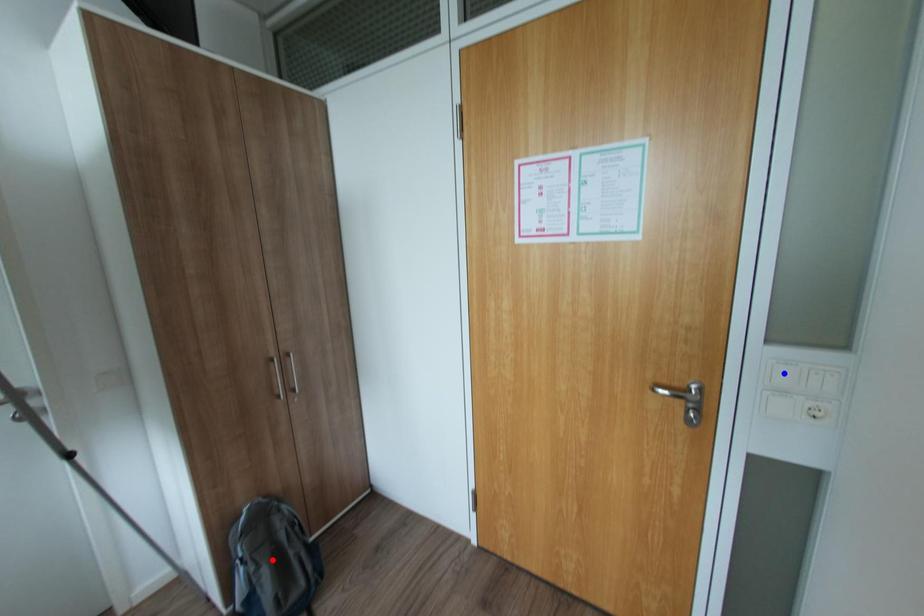
Question: Two points are marked on the image. Which point is closer to the camera?

Choices:
 (A) Blue point is closer.
 (B) Red point is closer.

Answer: (A)